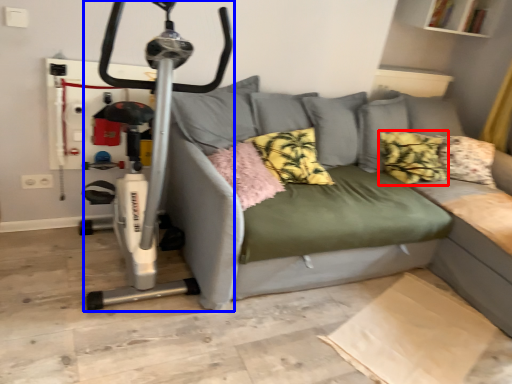
Question: Which of the following is the farthest to the observer, pillow (highlighted by a red box) or sport equipment (highlighted by a blue box)?

Choices:
 (A) pillow
 (B) sport equipment

Answer: (A)